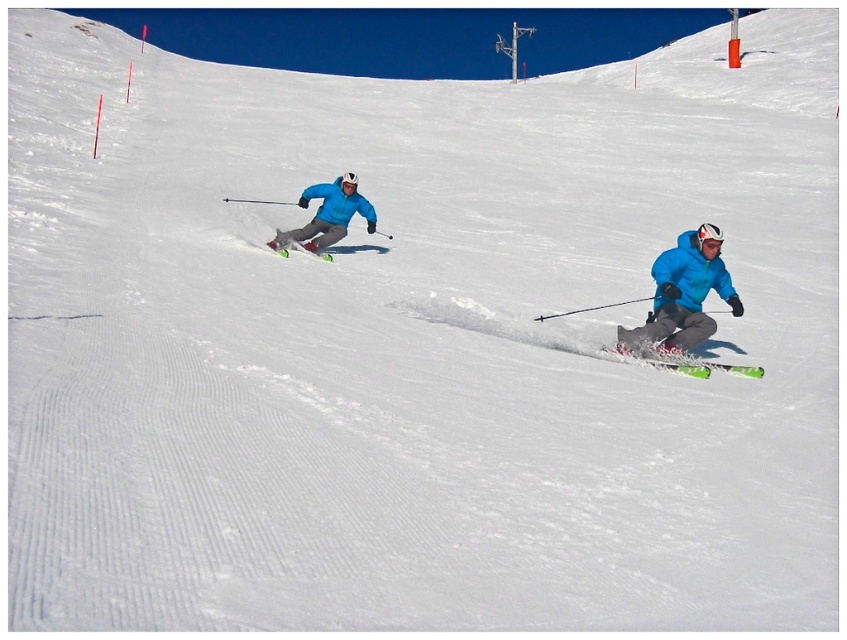
You are a photographer positioned at the origin of the coordinate system. You want to capture a photo of the blue matte jacket at center located at point (590,308). What is the exact coordinate of the blue matte jacket at center?

The blue matte jacket at center is located at point (590,308).

In the scene shown: You are a photographer planning to take a photo of the blue matte jacket at center. The camera has a focal length of 50mm and an aperture of f2.8. The point at coordinates point [590,308] is where you want to focus. Is this point within the depth of field for the jacket?

The point [590,308] corresponds to the blue matte jacket at center, so yes, focusing on this point will ensure the blue matte jacket at center is in focus.

You are a photographer trying to capture a photo of the blue matte jacket at center and the green glossy ski at lower right. Which object should you focus on first if you want to ensure both are in the frame without moving the camera?

The blue matte jacket at center is located above the green glossy ski at lower right, so you should focus on the blue matte jacket at center first to ensure both are in the frame without moving the camera.